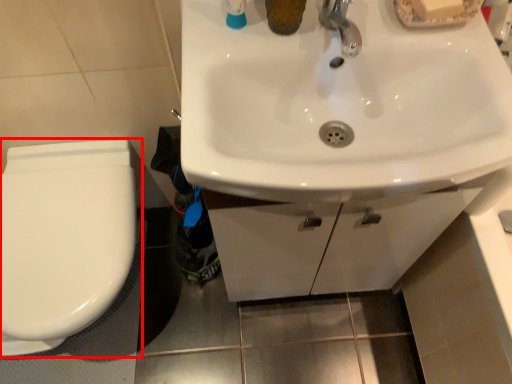
Question: In this image, where is toilet (annotated by the red box) located relative to sink?

Choices:
 (A) left
 (B) right

Answer: (A)